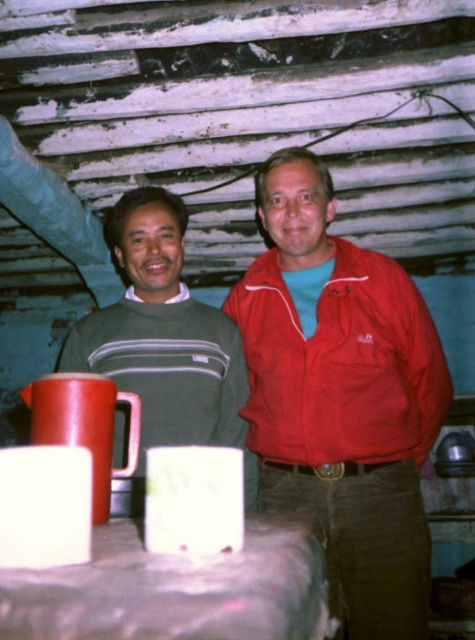
You are a photographer setting up a shoot in this rustic indoor setting. You have a red matte jacket at center and a white matte mug at center. If you want to place both items side by side on a shelf that can only accommodate items up to the width of the wider object, which object should you measure to determine the shelf width?

The red matte jacket at center is wider than the white matte mug at center, so you should measure the red matte jacket at center to determine the shelf width.

You are a barista who needs to place two matte red mugs on a shelf. The shelf is 6 inches wide. Can both matte red mug at center and matte red mug at lower left fit side by side on the shelf?

The distance between the matte red mug at center and matte red mug at lower left is 6.81 inches. Since the shelf is only 6 inches wide, the two mugs cannot fit side by side as they require more space than available.